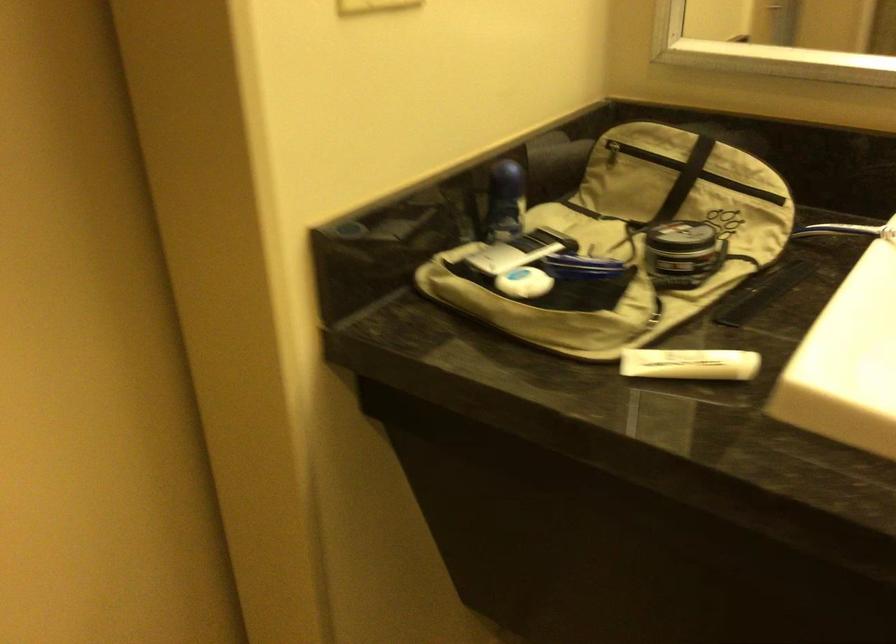
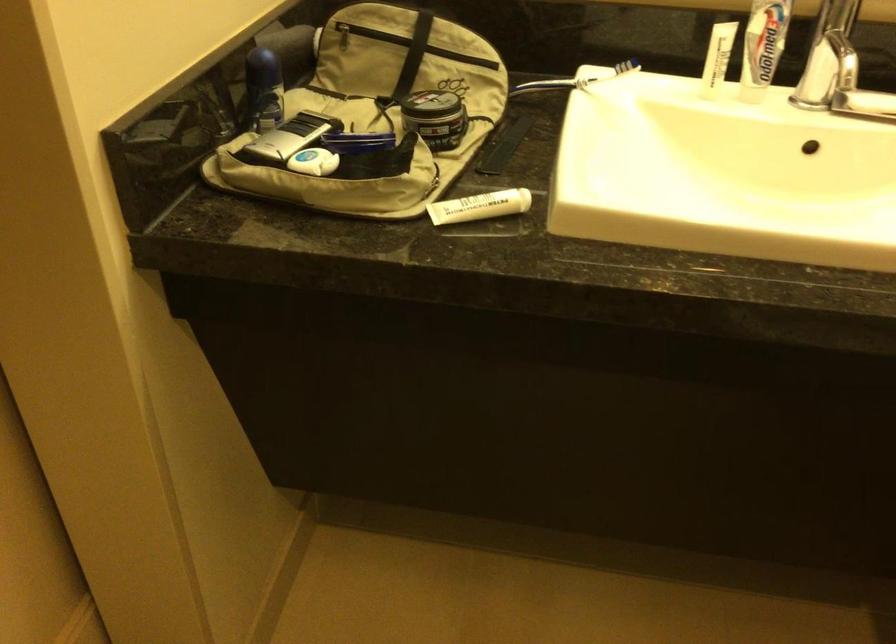
Locate, in the second image, the point that corresponds to the point at 687,365 in the first image.

(479, 205)